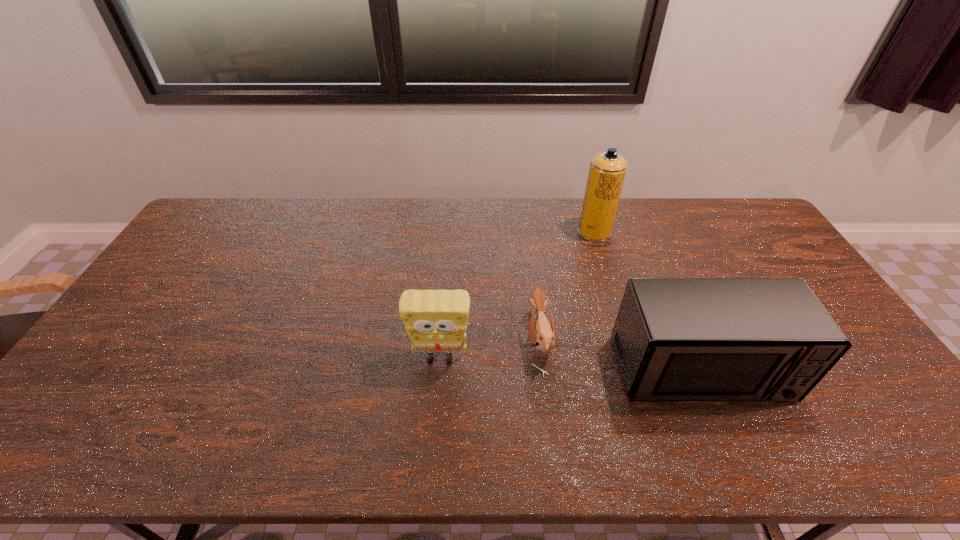
Where is `free space between the tallest object and the leftmost object`? The height and width of the screenshot is (540, 960). free space between the tallest object and the leftmost object is located at coordinates (517, 295).

Locate an element on the screen. The width and height of the screenshot is (960, 540). vacant area that lies between the shortest object and the sponge is located at coordinates (490, 349).

Image resolution: width=960 pixels, height=540 pixels. What are the coordinates of `blank region between the sponge and the farthest object` in the screenshot? It's located at (517, 295).

You are a GUI agent. You are given a task and a screenshot of the screen. Output one action in this format:
    pyautogui.click(x=<x>, y=<y>)
    Task: Click on the vacant region between the leftmost object and the microwave_oven
    The image size is (960, 540).
    Given the screenshot: What is the action you would take?
    pyautogui.click(x=570, y=364)

Identify which object is the closest to the sponge. Please provide its 2D coordinates. Your answer should be formatted as a tuple, i.e. [(x, y)], where the tuple contains the x and y coordinates of a point satisfying the conditions above.

[(542, 334)]

Identify which object is the closest to the sponge. Please provide its 2D coordinates. Your answer should be formatted as a tuple, i.e. [(x, y)], where the tuple contains the x and y coordinates of a point satisfying the conditions above.

[(542, 334)]

I want to click on free space that satisfies the following two spatial constraints: 1. at the beak of the bird; 2. on the face of the leftmost object, so click(541, 357).